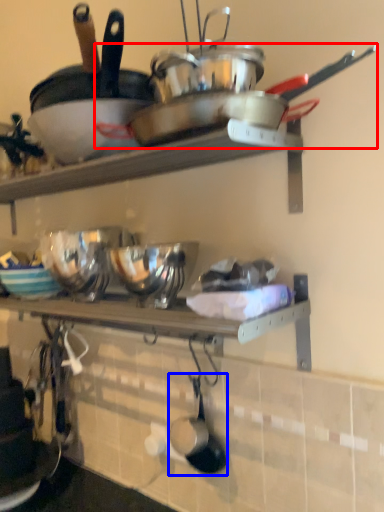
Question: Which object appears closest to the camera in this image, wok (highlighted by a red box) or frying pan (highlighted by a blue box)?

Choices:
 (A) wok
 (B) frying pan

Answer: (A)